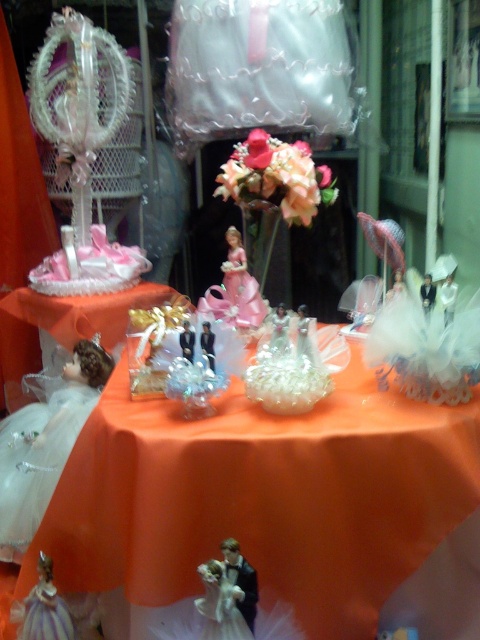
Question: Which point appears closest to the camera in this image?

Choices:
 (A) (300, 189)
 (B) (26, 488)
 (C) (451, 448)
 (D) (287, 336)

Answer: (C)

Question: Does pink silk flower at center have a larger size compared to matte black figurine at center?

Choices:
 (A) yes
 (B) no

Answer: (A)

Question: Does matte porcelain bride at center come in front of matte black figurine at center?

Choices:
 (A) no
 (B) yes

Answer: (A)

Question: Estimate the real-world distances between objects in this image. Which object is closer to the matte black figurine at center?

Choices:
 (A) orange satin tablecloth at center
 (B) matte gold figurine at center
 (C) matte porcelain bride at center
 (D) pink silk flower at center

Answer: (B)

Question: Which point is closer to the camera?

Choices:
 (A) orange satin tablecloth at center
 (B) matte gold figurine at center
 (C) matte porcelain bride at center
 (D) translucent white doll at lower left

Answer: (A)

Question: Can you confirm if orange satin tablecloth at center is positioned to the right of translucent white doll at lower left?

Choices:
 (A) yes
 (B) no

Answer: (A)